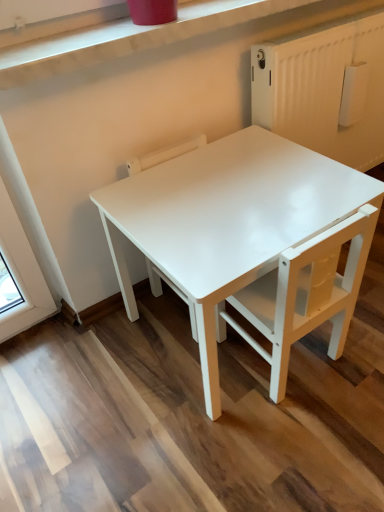
Question: Should I look upward or downward to see white glossy chair at center, which appears as the first chair when viewed from the left?

Choices:
 (A) up
 (B) down

Answer: (A)

Question: From the image's perspective, is white glossy table at center over white matte chair at center, which appears as the 1th chair when viewed from the right?

Choices:
 (A) yes
 (B) no

Answer: (A)

Question: From a real-world perspective, is white glossy table at center below white matte chair at center, which is the 2th chair in left-to-right order?

Choices:
 (A) yes
 (B) no

Answer: (A)

Question: Is white glossy table at center oriented towards white matte chair at center, which appears as the 1th chair when viewed from the right?

Choices:
 (A) no
 (B) yes

Answer: (B)

Question: Is the position of white glossy table at center less distant than that of white matte chair at center, which appears as the 1th chair when viewed from the right?

Choices:
 (A) no
 (B) yes

Answer: (B)

Question: Is white glossy table at center facing away from white matte chair at center, which is the 2th chair in left-to-right order?

Choices:
 (A) no
 (B) yes

Answer: (B)

Question: Considering the relative positions of white glossy table at center and white matte chair at center, which is the 2th chair in left-to-right order, in the image provided, is white glossy table at center to the right of white matte chair at center, which is the 2th chair in left-to-right order, from the viewer's perspective?

Choices:
 (A) yes
 (B) no

Answer: (B)

Question: From a real-world perspective, is white glossy chair at center, which is the 2th chair in right-to-left order, on top of white glossy table at center?

Choices:
 (A) yes
 (B) no

Answer: (A)

Question: Is white glossy chair at center, which is the 2th chair in right-to-left order, thinner than white glossy table at center?

Choices:
 (A) no
 (B) yes

Answer: (B)

Question: Is white glossy chair at center, which is the 2th chair in right-to-left order, beside white glossy table at center?

Choices:
 (A) yes
 (B) no

Answer: (B)

Question: Is white glossy chair at center, which appears as the first chair when viewed from the left, not within white glossy table at center?

Choices:
 (A) yes
 (B) no

Answer: (B)

Question: Is white glossy chair at center, which is the 2th chair in right-to-left order, smaller than white glossy table at center?

Choices:
 (A) yes
 (B) no

Answer: (A)

Question: Is white glossy table at center located within white glossy chair at center, which appears as the first chair when viewed from the left?

Choices:
 (A) no
 (B) yes

Answer: (A)

Question: Considering the relative sizes of white matte chair at center, which is the 2th chair in left-to-right order, and white glossy chair at center, which is the 2th chair in right-to-left order, in the image provided, is white matte chair at center, which is the 2th chair in left-to-right order, thinner than white glossy chair at center, which is the 2th chair in right-to-left order,?

Choices:
 (A) yes
 (B) no

Answer: (B)